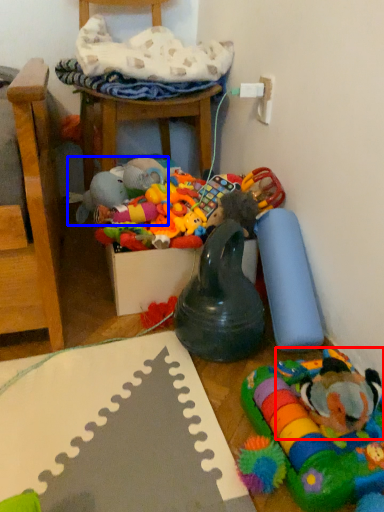
Question: Which of the following is the farthest to the observer, toy (highlighted by a red box) or toy (highlighted by a blue box)?

Choices:
 (A) toy
 (B) toy

Answer: (B)